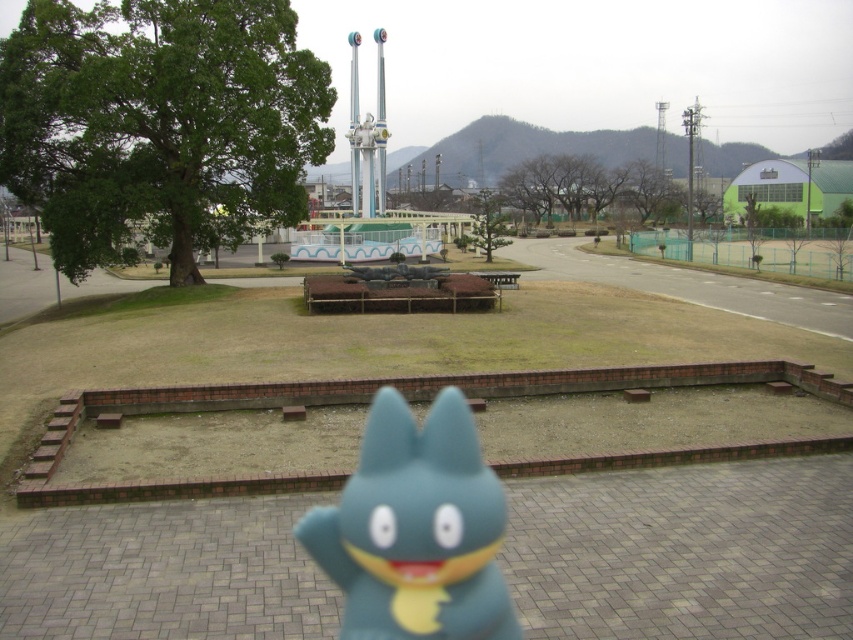
Locate an element on the screen. The width and height of the screenshot is (853, 640). blue rubber toy at center is located at coordinates (416, 529).

You are a GUI agent. You are given a task and a screenshot of the screen. Output one action in this format:
    pyautogui.click(x=<x>, y=<y>)
    Task: Click on the blue rubber toy at center
    This screenshot has height=640, width=853.
    Given the screenshot: What is the action you would take?
    pyautogui.click(x=416, y=529)